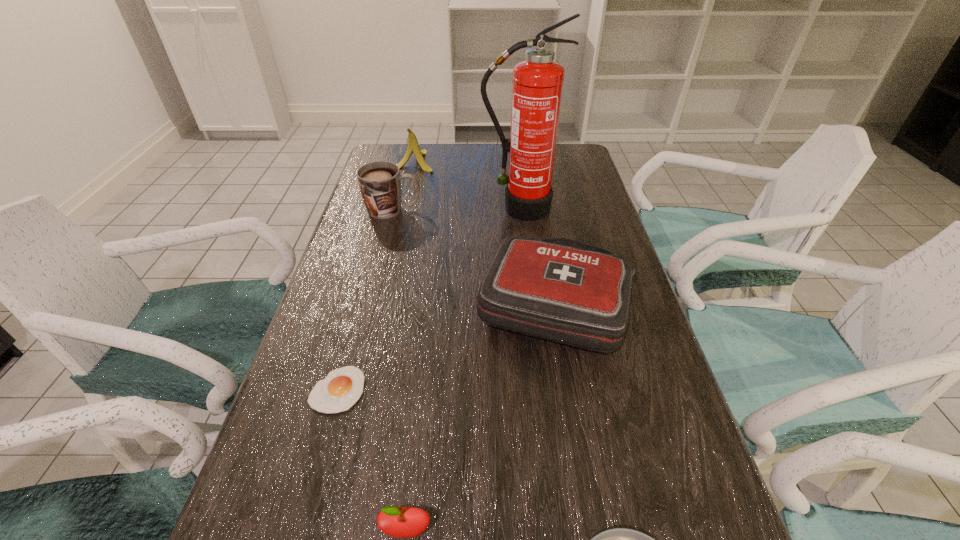
Locate an element on the screen. The height and width of the screenshot is (540, 960). the tallest object is located at coordinates (537, 87).

Where is `banana`? banana is located at coordinates (413, 146).

Where is `mug`? mug is located at coordinates (380, 182).

This screenshot has height=540, width=960. Find the location of `the fourth farthest object`. the fourth farthest object is located at coordinates (558, 289).

Find the location of a particular element. egg yolk is located at coordinates (341, 389).

Where is `the fifth farthest object`? The height and width of the screenshot is (540, 960). the fifth farthest object is located at coordinates (341, 389).

What are the coordinates of `vacant space situated 0.360m on the front-facing side of the tallest object` in the screenshot? It's located at (531, 310).

Locate an element on the screen. vacant space located 0.090m on the front of the farthest object is located at coordinates (407, 187).

Locate an element on the screen. The image size is (960, 540). free location located on the side of the mug with the handle is located at coordinates (540, 210).

The height and width of the screenshot is (540, 960). I want to click on free space located on the left of the fourth farthest object, so click(x=409, y=303).